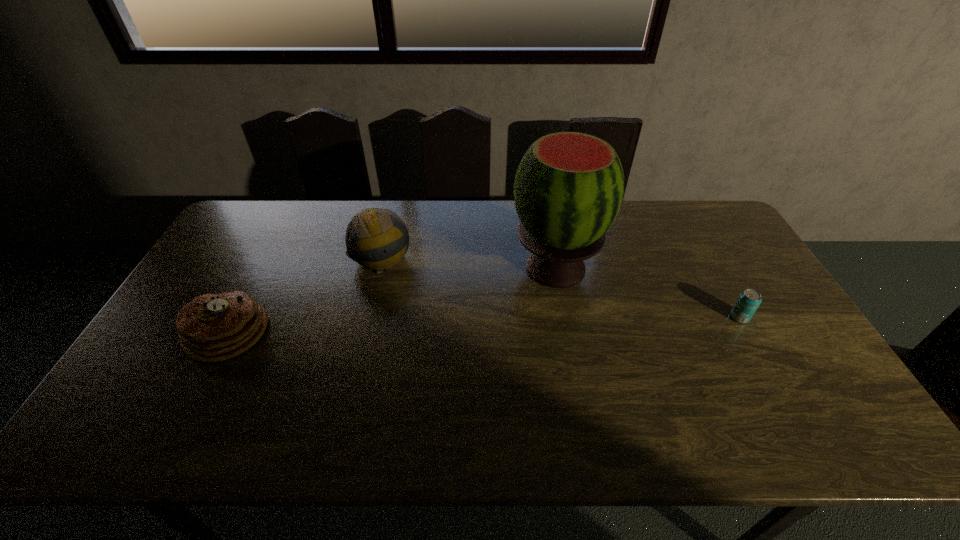
Find the location of `free space located on the back of the leftmost object`. free space located on the back of the leftmost object is located at coordinates (273, 246).

Locate an element on the screen. free location located on the back of the shortest object is located at coordinates (694, 237).

The width and height of the screenshot is (960, 540). In order to click on watermelon present at the far edge in this screenshot , I will do `click(569, 187)`.

The height and width of the screenshot is (540, 960). Find the location of `volleyball that is at the far edge`. volleyball that is at the far edge is located at coordinates (376, 238).

Locate an element on the screen. The image size is (960, 540). object that is positioned at the left edge is located at coordinates (211, 328).

You are a GUI agent. You are given a task and a screenshot of the screen. Output one action in this format:
    pyautogui.click(x=<x>, y=<y>)
    Task: Click on the object located in the right edge section of the desktop
    
    Given the screenshot: What is the action you would take?
    pyautogui.click(x=749, y=300)

In the image, there is a desktop. What are the coordinates of `vacant region at the far edge` in the screenshot? It's located at pyautogui.click(x=649, y=230).

Identify the location of free spot at the near edge of the desktop. (297, 424).

I want to click on vacant space at the right edge of the desktop, so click(x=812, y=383).

Identify the location of free space at the near left corner of the desktop. click(156, 431).